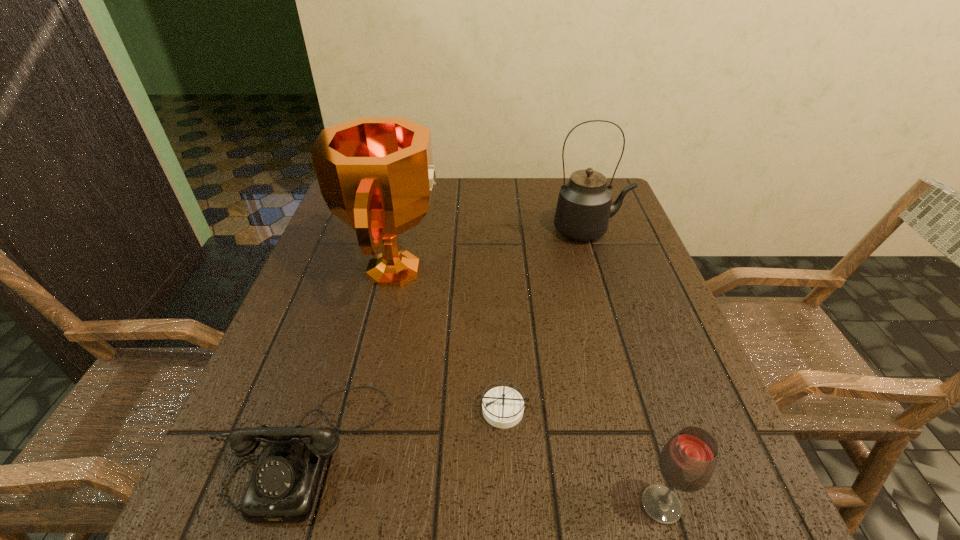
What are the coordinates of `vacant region at the near edge of the desktop` in the screenshot? It's located at (377, 537).

Locate an element on the screen. vacant space at the left edge of the desktop is located at coordinates (364, 287).

This screenshot has height=540, width=960. I want to click on free space at the right edge of the desktop, so click(x=690, y=362).

This screenshot has height=540, width=960. I want to click on vacant space that's between the shortest object and the award, so click(x=449, y=339).

Locate an element on the screen. free spot between the third tallest object and the award is located at coordinates (528, 387).

Locate an element on the screen. free space between the kettle and the compass is located at coordinates (546, 320).

I want to click on free space between the glass drink container and the award, so click(x=528, y=387).

Locate an element on the screen. This screenshot has height=540, width=960. vacant area that lies between the glass drink container and the kettle is located at coordinates [x=625, y=368].

I want to click on empty space that is in between the glass drink container and the third object from right to left, so click(x=582, y=457).

Identify the location of empty space between the award and the fourth tallest object. (349, 359).